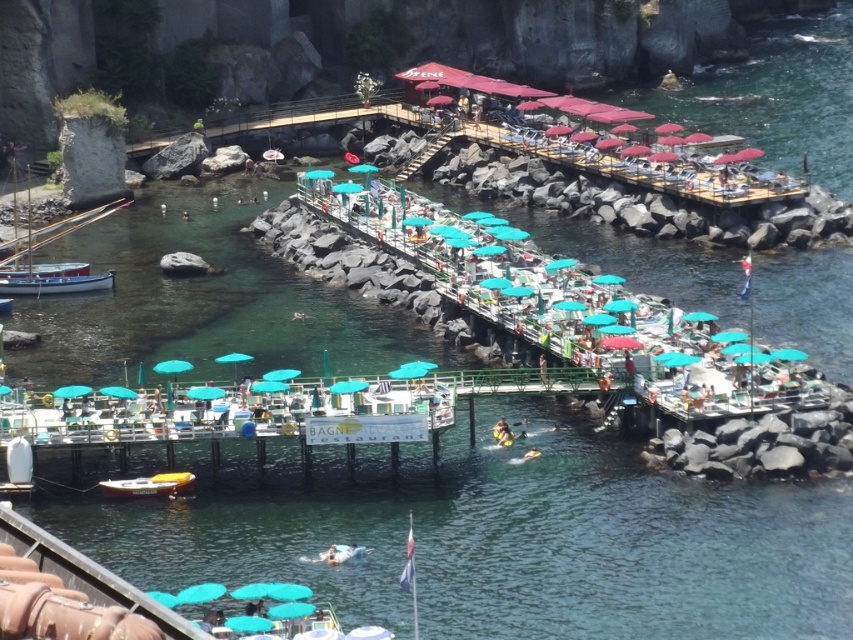
Can you confirm if green plastic umbrellas at center is thinner than teal fabric umbrella at center?

No, green plastic umbrellas at center is not thinner than teal fabric umbrella at center.

What do you see at coordinates (496, 536) in the screenshot? This screenshot has width=853, height=640. I see `green plastic umbrellas at center` at bounding box center [496, 536].

Which is behind, point (294, 512) or point (637, 307)?

The point (637, 307) is behind.

Locate an element on the screen. The width and height of the screenshot is (853, 640). green plastic umbrellas at center is located at coordinates (496, 536).

Between point (514, 236) and point (15, 182), which one is positioned in front?

Point (514, 236) is in front.

Identify the location of teal fabric umbrella at center. The height and width of the screenshot is (640, 853). tap(485, 266).

I want to click on teal fabric umbrella at center, so [485, 266].

Is green plastic umbrellas at center thinner than white wooden boat at left?

No.

You are a GUI agent. You are given a task and a screenshot of the screen. Output one action in this format:
    pyautogui.click(x=<x>, y=<y>)
    Task: Click on the green plastic umbrellas at center
    Image resolution: width=853 pixels, height=640 pixels.
    Given the screenshot: What is the action you would take?
    pyautogui.click(x=496, y=536)

Locate an element on the screen. The height and width of the screenshot is (640, 853). green plastic umbrellas at center is located at coordinates (496, 536).